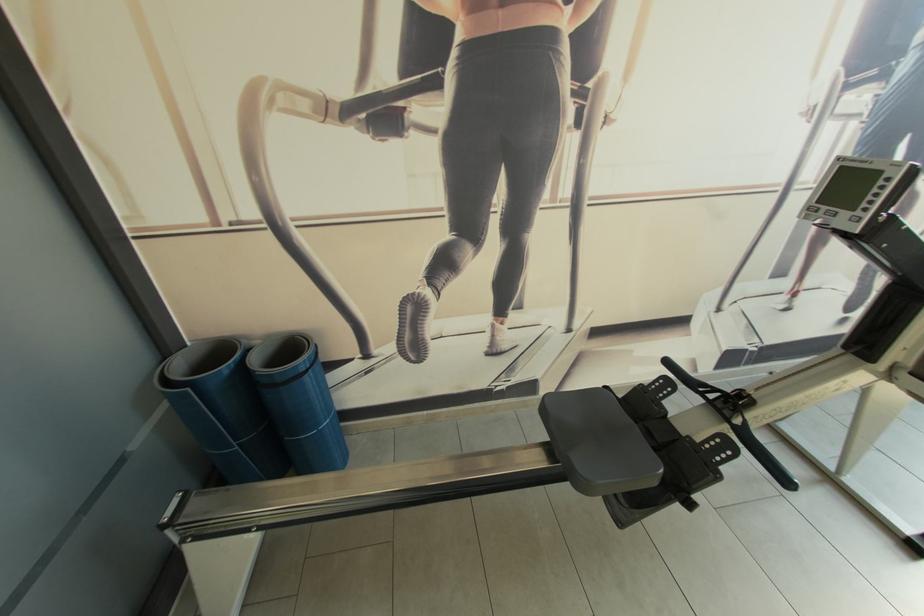
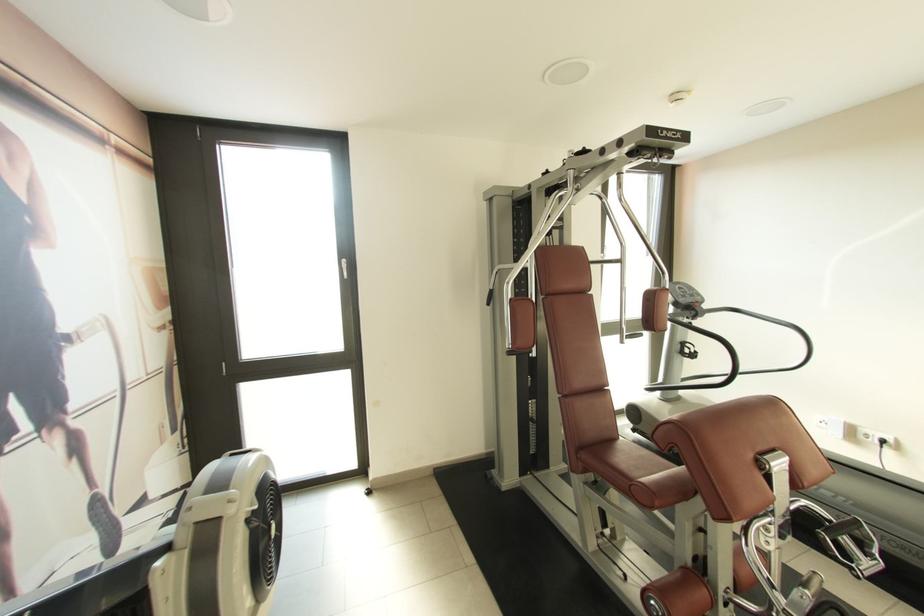
Question: The camera is either moving clockwise (left) or counter-clockwise (right) around the object. The first image is from the beginning of the video and the second image is from the end. Is the camera moving left or right when shooting the video?

Choices:
 (A) Left
 (B) Right

Answer: (A)